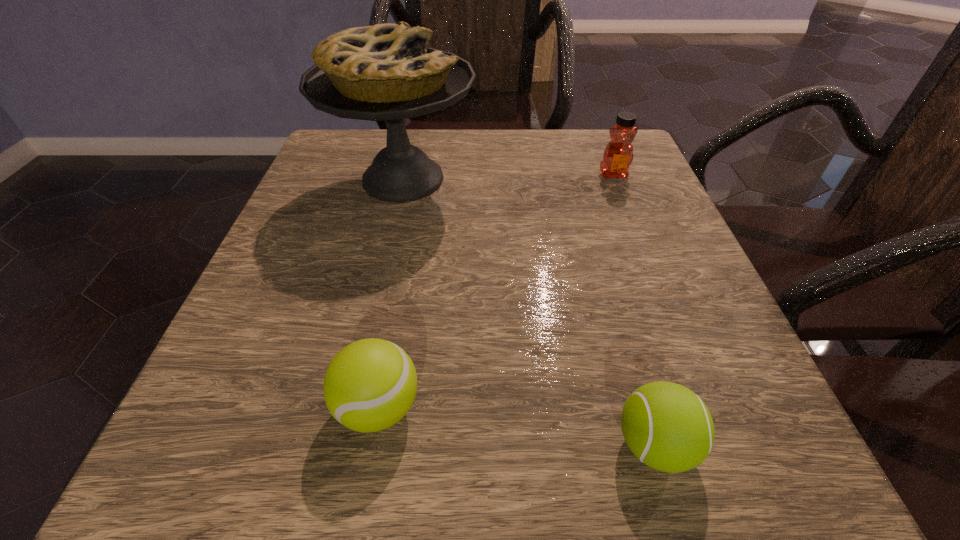
Find the location of a particular element. The image size is (960, 540). the tallest object is located at coordinates (382, 72).

Where is `honey`? The height and width of the screenshot is (540, 960). honey is located at coordinates (618, 155).

Locate an element on the screen. the left tennis ball is located at coordinates (370, 385).

Image resolution: width=960 pixels, height=540 pixels. I want to click on the right tennis ball, so click(x=668, y=427).

You are a GUI agent. You are given a task and a screenshot of the screen. Output one action in this format:
    pyautogui.click(x=<x>, y=<y>)
    Task: Click on the free point located on the cut side of the tallest object
    
    Given the screenshot: What is the action you would take?
    pyautogui.click(x=580, y=179)

Locate an element on the screen. free space located on the front label of the honey is located at coordinates (649, 264).

Where is `vacant position located 0.130m on the left of the left tennis ball`? This screenshot has width=960, height=540. vacant position located 0.130m on the left of the left tennis ball is located at coordinates (229, 407).

Where is `free space located on the left of the right tennis ball`? free space located on the left of the right tennis ball is located at coordinates (441, 445).

Locate an element on the screen. The height and width of the screenshot is (540, 960). pie positioned at the far edge is located at coordinates (382, 72).

Where is `honey that is at the far edge`? This screenshot has width=960, height=540. honey that is at the far edge is located at coordinates (618, 155).